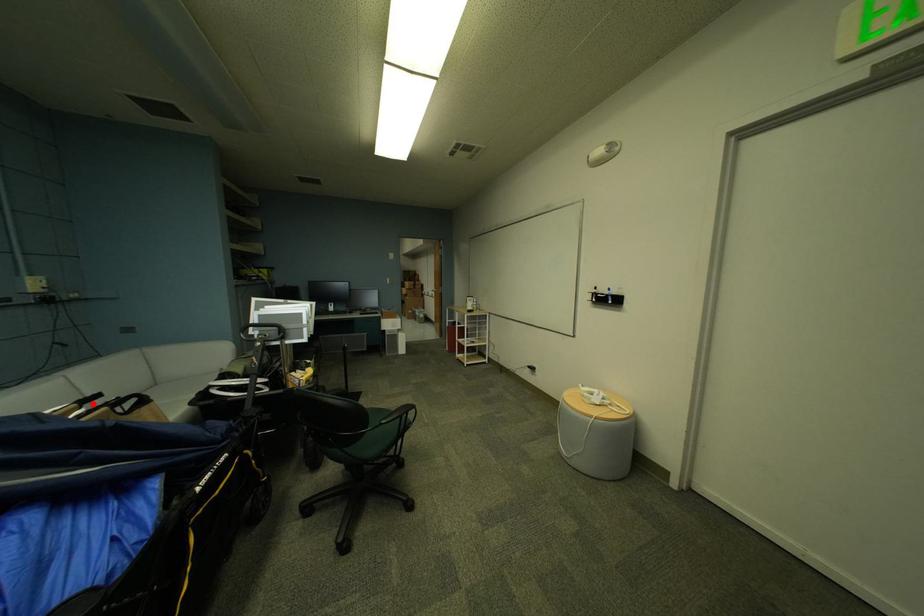
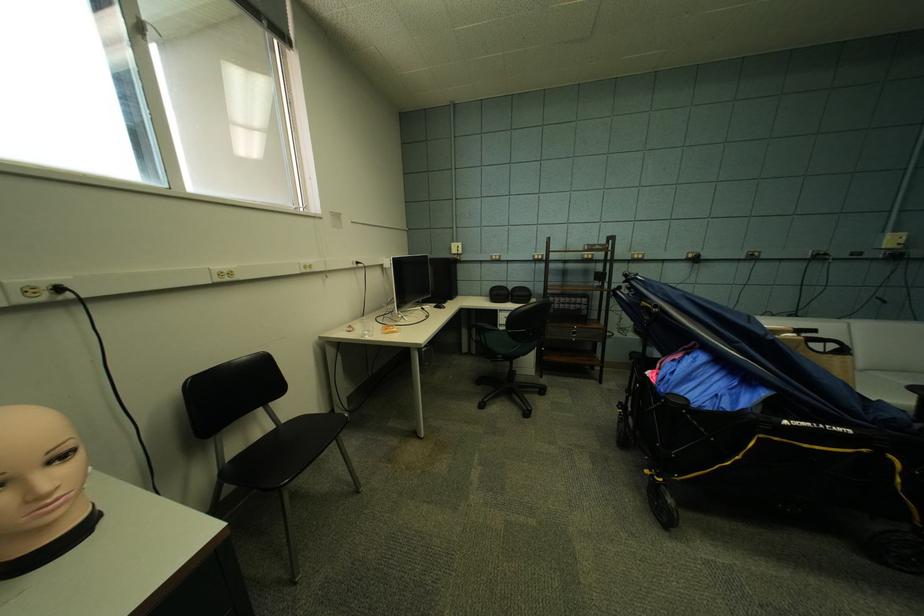
Question: I am providing you with two images of the same scene from different viewpoints. Given a red point in image1, look at the same physical point in image2. Is it:

Choices:
 (A) Closer to the viewpoint
 (B) Farther from the viewpoint

Answer: (A)